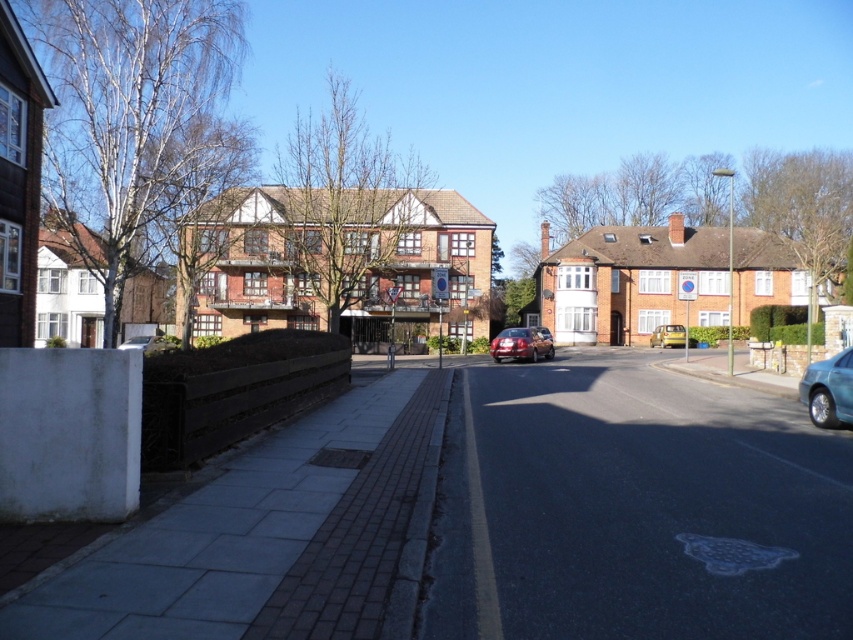
Is teal glossy sedan at right bigger than yellow matte van at center?

No, teal glossy sedan at right is not bigger than yellow matte van at center.

Describe the element at coordinates (828, 390) in the screenshot. The height and width of the screenshot is (640, 853). I see `teal glossy sedan at right` at that location.

Identify the location of teal glossy sedan at right. (828, 390).

The image size is (853, 640). What do you see at coordinates (828, 390) in the screenshot?
I see `teal glossy sedan at right` at bounding box center [828, 390].

Is teal glossy sedan at right thinner than matte silver car at lower left?

Yes, teal glossy sedan at right is thinner than matte silver car at lower left.

The height and width of the screenshot is (640, 853). Find the location of `teal glossy sedan at right`. teal glossy sedan at right is located at coordinates (828, 390).

Is teal glossy sedan at right below satin red sedan at center?

Yes.

Describe the element at coordinates (828, 390) in the screenshot. The width and height of the screenshot is (853, 640). I see `teal glossy sedan at right` at that location.

Find the location of a particular element. This screenshot has width=853, height=640. teal glossy sedan at right is located at coordinates (828, 390).